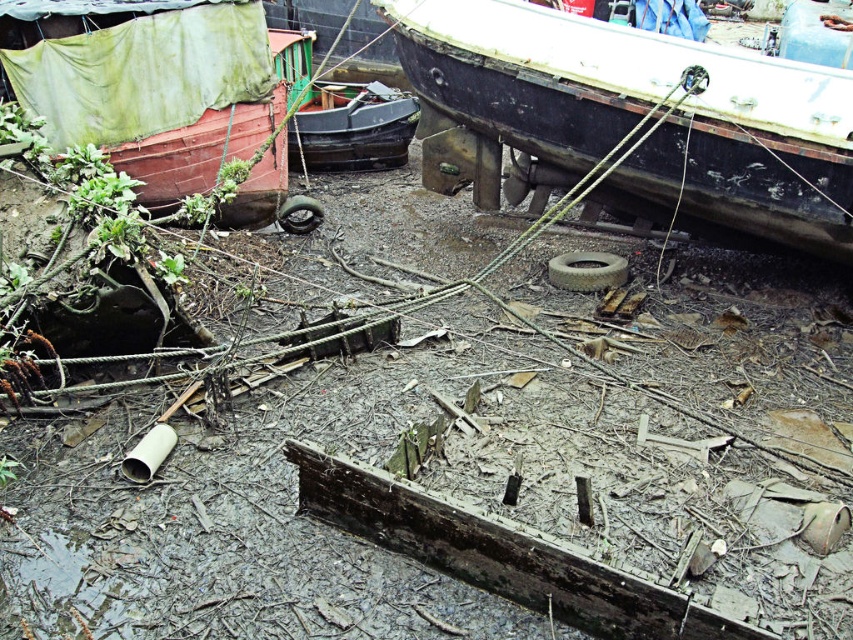
You are a maintenance worker inspecting the abandoned boatyard. You see the rusty metal boat at upper right and the gray rubber tire at center. Which object is closer to you?

The rusty metal boat at upper right is closer to you because it is in front of the gray rubber tire at center.

You are standing at the edge of the boatyard and want to walk to the point labeled as point [287,216]. However, you first need to pass through point [608,253]. Which point should you reach first according to their positions?

You should reach point [608,253] first because it is closer to you than point [287,216].